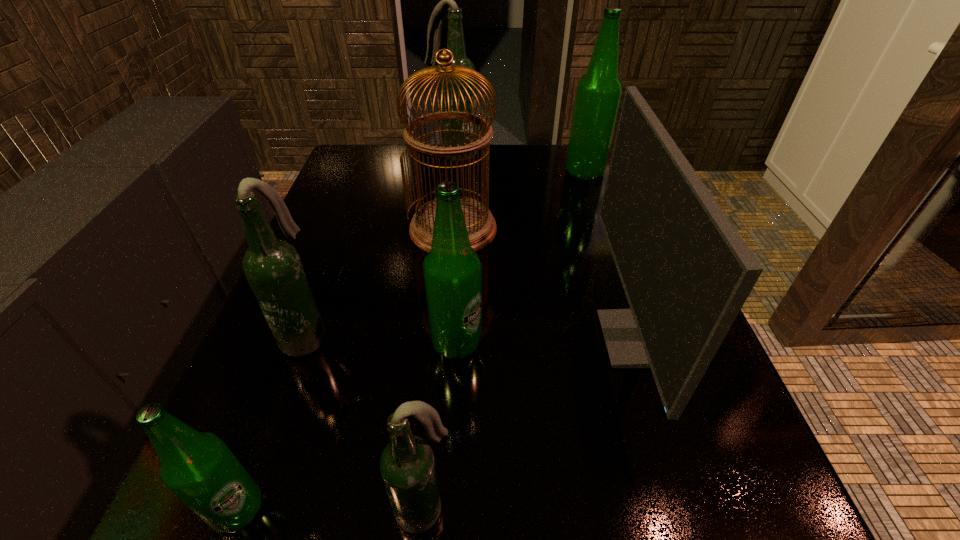
I want to click on the biggest dark beer bottle, so click(x=455, y=40).

The width and height of the screenshot is (960, 540). I want to click on the farthest green beer bottle, so click(x=598, y=92).

The height and width of the screenshot is (540, 960). I want to click on the biggest green beer bottle, so tap(598, 92).

Where is `birdcage`? birdcage is located at coordinates (x=481, y=226).

At what (x,y) coordinates should I click in order to perform the action: click on computer monitor. Please return your answer as a coordinate pair (x, y). Image resolution: width=960 pixels, height=540 pixels. Looking at the image, I should click on (686, 272).

Where is `the second nearest green beer bottle`? The width and height of the screenshot is (960, 540). the second nearest green beer bottle is located at coordinates (452, 270).

At what (x,y) coordinates should I click in order to perform the action: click on the second smallest green beer bottle. Please return your answer as a coordinate pair (x, y). The width and height of the screenshot is (960, 540). Looking at the image, I should click on (452, 270).

Where is `the second nearest dark beer bottle`? This screenshot has width=960, height=540. the second nearest dark beer bottle is located at coordinates (272, 267).

The height and width of the screenshot is (540, 960). I want to click on the leftmost dark beer bottle, so click(272, 267).

Locate an element on the screen. The width and height of the screenshot is (960, 540). the smallest green beer bottle is located at coordinates (197, 467).